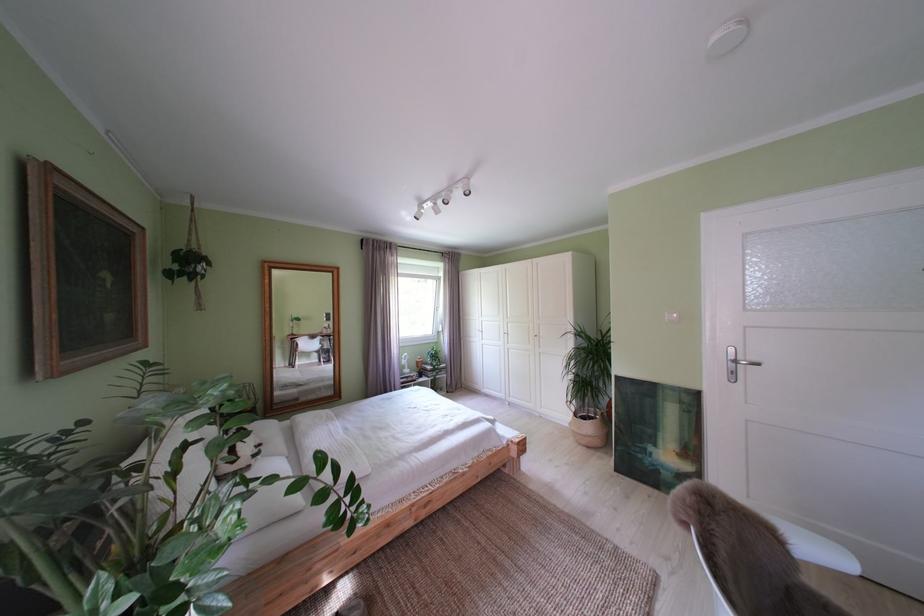
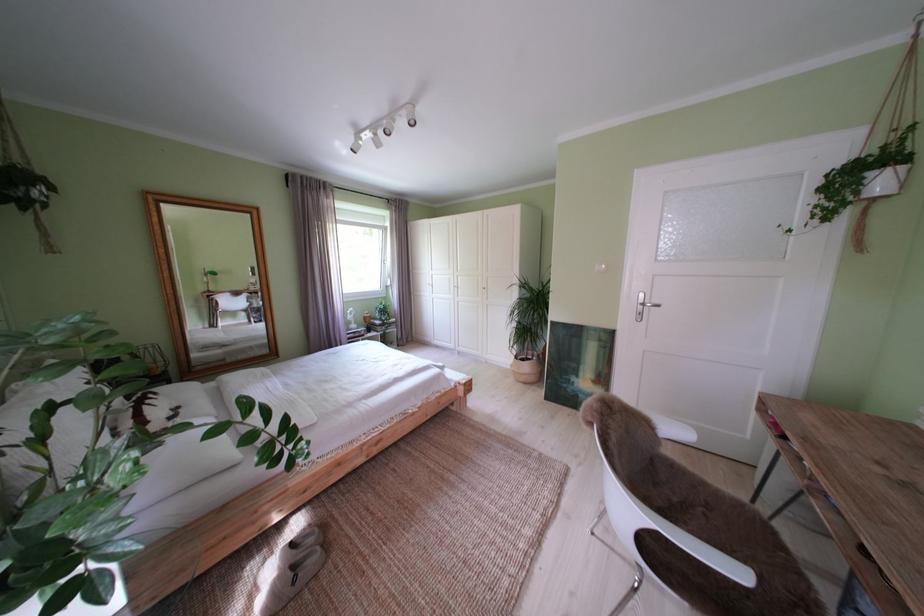
Question: The images are taken continuously from a first-person perspective. In which direction is your viewpoint rotating?

Choices:
 (A) Left
 (B) Right
 (C) Up
 (D) Down

Answer: (B)